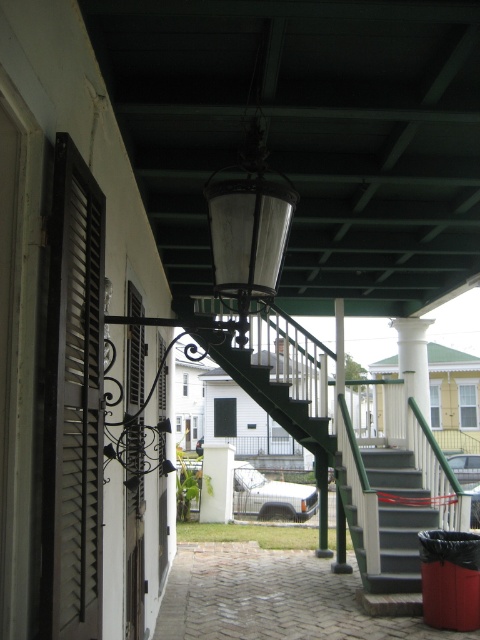
In the scene shown: Is dark gray concrete stairs at center taller than white painted wood shutter at left?

No, dark gray concrete stairs at center is not taller than white painted wood shutter at left.

Between dark gray concrete stairs at center and white painted wood shutter at left, which one is positioned higher?

Positioned higher is white painted wood shutter at left.

Where is `dark gray concrete stairs at center`? The height and width of the screenshot is (640, 480). dark gray concrete stairs at center is located at coordinates (388, 540).

You are a GUI agent. You are given a task and a screenshot of the screen. Output one action in this format:
    pyautogui.click(x=<x>, y=<y>)
    Task: Click on the dark gray concrete stairs at center
    
    Given the screenshot: What is the action you would take?
    pyautogui.click(x=388, y=540)

Looking at this image, who is shorter, black matte shutters at left or white painted wood shutter at left?

black matte shutters at left

Which is more to the left, black matte shutters at left or white painted wood shutter at left?

From the viewer's perspective, white painted wood shutter at left appears more on the left side.

This screenshot has height=640, width=480. Identify the location of black matte shutters at left. (75, 394).

The width and height of the screenshot is (480, 640). Identify the location of black matte shutters at left. (75, 394).

Can you confirm if black matte shutters at left is taller than dark gray concrete stairs at center?

Yes.

Between black matte shutters at left and dark gray concrete stairs at center, which one is positioned lower?

dark gray concrete stairs at center is below.

This screenshot has height=640, width=480. I want to click on black matte shutters at left, so click(75, 394).

At what (x,y) coordinates should I click in order to perform the action: click on black matte shutters at left. Please return your answer as a coordinate pair (x, y). Looking at the image, I should click on (75, 394).